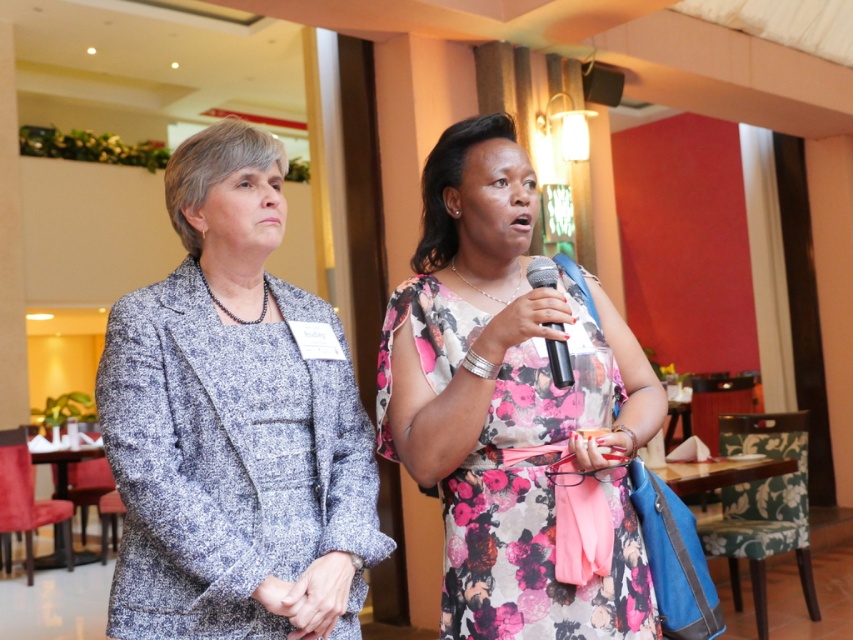
Does speckled wool blazer at left have a greater width compared to floral dress at center?

No, speckled wool blazer at left is not wider than floral dress at center.

I want to click on speckled wool blazer at left, so click(x=234, y=422).

Can you confirm if speckled wool blazer at left is smaller than metallic silver microphone at center?

Actually, speckled wool blazer at left might be larger than metallic silver microphone at center.

Is speckled wool blazer at left to the right of metallic silver microphone at center from the viewer's perspective?

In fact, speckled wool blazer at left is to the left of metallic silver microphone at center.

Which is in front, point (194, 547) or point (560, 380)?

Positioned in front is point (194, 547).

The width and height of the screenshot is (853, 640). Find the location of `speckled wool blazer at left`. speckled wool blazer at left is located at coordinates (234, 422).

Does floral dress at center have a greater width compared to metallic silver microphone at center?

Correct, the width of floral dress at center exceeds that of metallic silver microphone at center.

Is floral dress at center taller than metallic silver microphone at center?

Yes.

What do you see at coordinates (505, 404) in the screenshot? I see `floral dress at center` at bounding box center [505, 404].

At what (x,y) coordinates should I click in order to perform the action: click on floral dress at center. Please return your answer as a coordinate pair (x, y). Image resolution: width=853 pixels, height=640 pixels. Looking at the image, I should click on (505, 404).